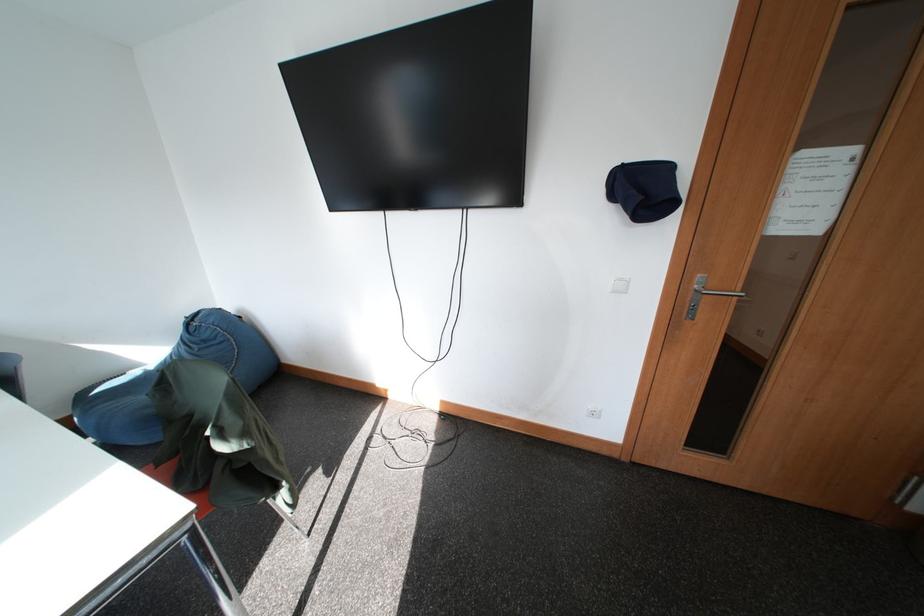
Locate an element on the screen. This screenshot has height=616, width=924. white light switch is located at coordinates (619, 285).